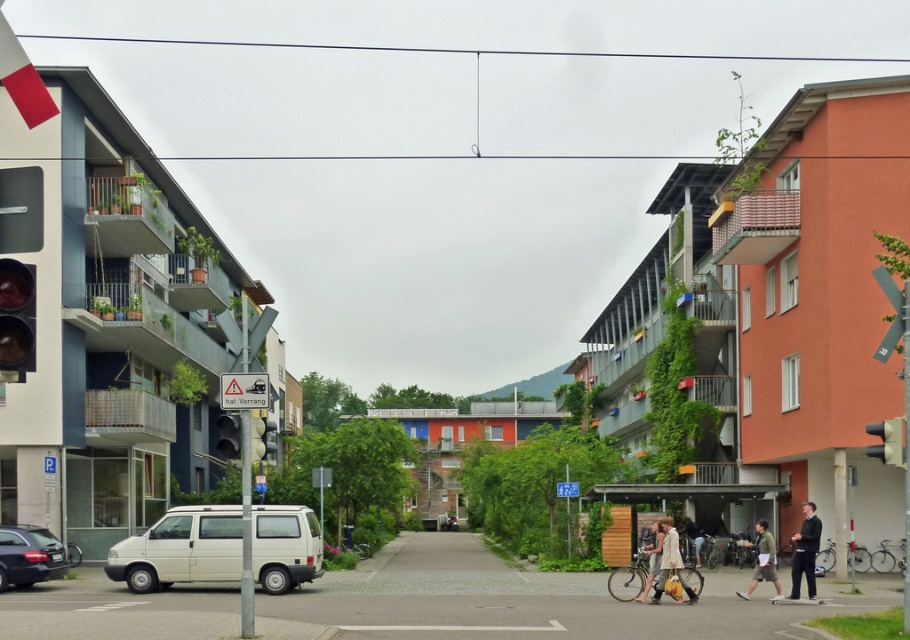
The width and height of the screenshot is (910, 640). What do you see at coordinates (805, 552) in the screenshot? I see `dark suit at lower right` at bounding box center [805, 552].

Is dark suit at lower right smaller than light beige fabric bag at lower right?

Incorrect, dark suit at lower right is not smaller in size than light beige fabric bag at lower right.

Is point (807, 524) positioned after point (665, 564)?

Yes, point (807, 524) is farther from viewer.

The width and height of the screenshot is (910, 640). What are the coordinates of `dark suit at lower right` in the screenshot? It's located at (805, 552).

Identify the location of white matte van at center. [180, 548].

Locate an element on the screen. This screenshot has height=640, width=910. white matte van at center is located at coordinates (180, 548).

Who is taller, matte black traffic light at left or khaki shorts at lower right?

Standing taller between the two is matte black traffic light at left.

Is matte black traffic light at left smaller than khaki shorts at lower right?

Actually, matte black traffic light at left might be larger than khaki shorts at lower right.

Where is `matte black traffic light at left`? This screenshot has width=910, height=640. matte black traffic light at left is located at coordinates (224, 435).